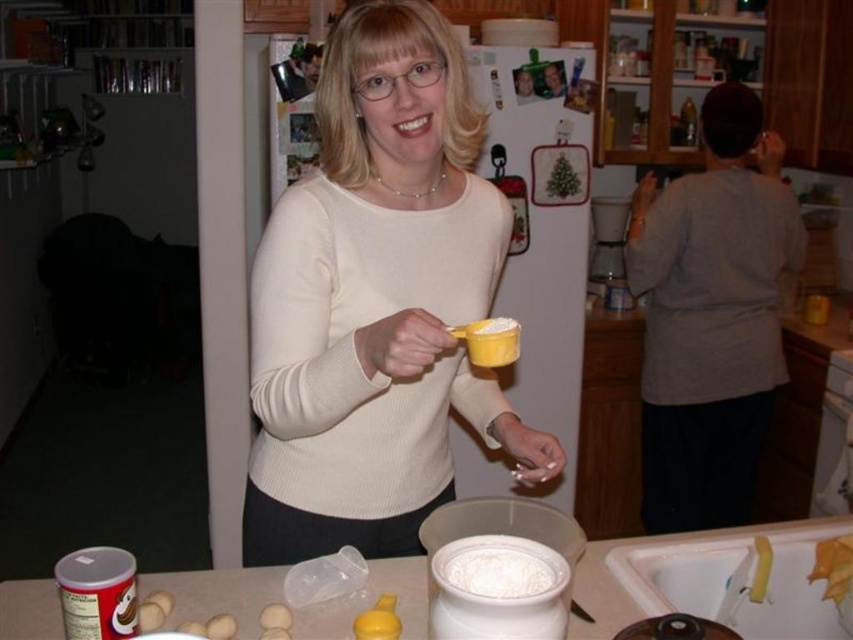
You are a chef in a kitchen. You see two yellow matte eggs at center and yellow matte eggs at lower left. Which one is positioned lower on the counter?

The yellow matte eggs at center is positioned lower than the yellow matte eggs at lower left.

You are a chef trying to locate the white powdery substance at center in the kitchen scene. Where would you look relative to the gray cotton shirt at upper right?

The white powdery substance at center is located below the gray cotton shirt at upper right.

You are a chef preparing a recipe that requires precise measurements. You have two yellow matte eggs at center and yellow matte eggs at lower left. Which one should you use if the recipe specifies using the taller egg?

You should use the yellow matte eggs at center because it is taller than the yellow matte eggs at lower left according to the description.